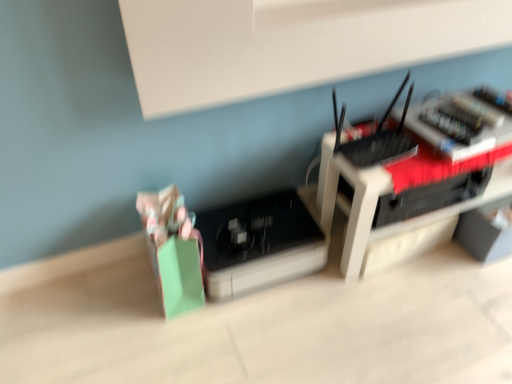
In order to click on black plastic router at upper right, positioned as the 2th register in back-to-front order in this screenshot , I will do `click(379, 139)`.

You are a GUI agent. You are given a task and a screenshot of the screen. Output one action in this format:
    pyautogui.click(x=<x>, y=<y>)
    Task: Click on the black plastic register at center, the 2th register from the top
    The image size is (512, 384).
    Given the screenshot: What is the action you would take?
    pos(259,244)

Based on their positions, is black plastic router at upper right, the 1th register when ordered from top to bottom, located to the left or right of black plastic register at center, the 2th register from the top?

Based on their positions, black plastic router at upper right, the 1th register when ordered from top to bottom, is located to the right of black plastic register at center, the 2th register from the top.

Can you see black plastic router at upper right, positioned as the first register in front-to-back order, touching black plastic register at center, marked as the first register in a back-to-front arrangement?

black plastic router at upper right, positioned as the first register in front-to-back order, is not next to black plastic register at center, marked as the first register in a back-to-front arrangement, and they're not touching.

From a real-world perspective, between black plastic router at upper right, positioned as the 2th register in back-to-front order, and black plastic register at center, marked as the first register in a back-to-front arrangement, who is vertically lower?

black plastic register at center, marked as the first register in a back-to-front arrangement, is physically lower.

Is black plastic register at center, the first register positioned from the left, facing away from black plastic router at upper right, positioned as the first register in front-to-back order?

No.

Does black plastic register at center, the first register positioned from the left, have a smaller size compared to black plastic router at upper right, which ranks as the 2th register in bottom-to-top order?

No, black plastic register at center, the first register positioned from the left, is not smaller than black plastic router at upper right, which ranks as the 2th register in bottom-to-top order.

Between black plastic register at center, marked as the first register in a back-to-front arrangement, and black plastic router at upper right, which ranks as the 2th register in bottom-to-top order, which one is positioned behind?

black plastic register at center, marked as the first register in a back-to-front arrangement, is further from the camera.

How many degrees apart are the facing directions of black plastic register at center, marked as the first register in a bottom-to-top arrangement, and black plastic router at upper right, positioned as the 2th register in back-to-front order?

black plastic register at center, marked as the first register in a bottom-to-top arrangement, and black plastic router at upper right, positioned as the 2th register in back-to-front order, are facing 6.16 degrees away from each other.

Is the depth of black plastic router at upper right, positioned as the first register in front-to-back order, greater than that of black plastic router at center?

No, black plastic router at upper right, positioned as the first register in front-to-back order, is closer to the camera.

Based on their sizes in the image, would you say black plastic router at upper right, which ranks as the 2th register in bottom-to-top order, is bigger or smaller than black plastic router at center?

black plastic router at upper right, which ranks as the 2th register in bottom-to-top order, is smaller than black plastic router at center.

Based on the photo, from the image's perspective, does black plastic router at upper right, which ranks as the 2th register in bottom-to-top order, appear higher than black plastic router at center?

Yes, from the image's perspective, black plastic router at upper right, which ranks as the 2th register in bottom-to-top order, is on top of black plastic router at center.

Is black plastic router at upper right, positioned as the 2th register in back-to-front order, to the left of black plastic router at center from the viewer's perspective?

Indeed, black plastic router at upper right, positioned as the 2th register in back-to-front order, is positioned on the left side of black plastic router at center.

Looking at this image, in terms of height, does black plastic router at center look taller or shorter compared to black plastic register at center, placed as the second register when sorted from right to left?

Clearly, black plastic router at center is taller compared to black plastic register at center, placed as the second register when sorted from right to left.

Measure the distance between black plastic router at center and black plastic register at center, the 2th register from the top.

black plastic router at center is 11.00 inches away from black plastic register at center, the 2th register from the top.

From the image's perspective, which one is positioned lower, black plastic router at center or black plastic register at center, which ranks as the second register in front-to-back order?

black plastic register at center, which ranks as the second register in front-to-back order, is shown below in the image.

I want to click on furniture lying in front of the black plastic register at center, which ranks as the second register in front-to-back order, so click(393, 194).

Is black plastic router at center turned away from black plastic router at upper right, the first register viewed from the right?

No.

Is black plastic router at center inside the boundaries of black plastic router at upper right, placed as the 2th register when sorted from left to right, or outside?

black plastic router at center is not enclosed by black plastic router at upper right, placed as the 2th register when sorted from left to right.

Which is further, (373, 261) or (413, 146)?

Point (373, 261)

Considering the sizes of objects black plastic router at center and black plastic router at upper right, the 1th register when ordered from top to bottom, in the image provided, who is smaller, black plastic router at center or black plastic router at upper right, the 1th register when ordered from top to bottom,?

black plastic router at upper right, the 1th register when ordered from top to bottom, is smaller.

From a real-world perspective, is black plastic register at center, the first register positioned from the left, physically located above or below black plastic router at center?

In terms of real-world spatial position, black plastic register at center, the first register positioned from the left, is below black plastic router at center.

Could you measure the distance between black plastic register at center, which ranks as the second register in front-to-back order, and black plastic router at center?

black plastic register at center, which ranks as the second register in front-to-back order, is 27.93 centimeters away from black plastic router at center.

Who is shorter, black plastic register at center, which ranks as the second register in front-to-back order, or black plastic router at center?

Standing shorter between the two is black plastic register at center, which ranks as the second register in front-to-back order.

From the image's perspective, is black plastic register at center, marked as the first register in a bottom-to-top arrangement, located above black plastic router at center?

Incorrect, from the image's perspective, black plastic register at center, marked as the first register in a bottom-to-top arrangement, is lower than black plastic router at center.

At what (x,y) coordinates should I click in order to perform the action: click on register behind the black plastic router at upper right, which ranks as the 2th register in bottom-to-top order. Please return your answer as a coordinate pair (x, y). This screenshot has width=512, height=384. Looking at the image, I should click on (259, 244).

Image resolution: width=512 pixels, height=384 pixels. In order to click on register located underneath the black plastic router at upper right, which ranks as the 2th register in bottom-to-top order (from a real-world perspective) in this screenshot , I will do `click(259, 244)`.

Based on their spatial positions, is black plastic router at upper right, positioned as the first register in front-to-back order, or black plastic register at center, the 2th register from the top, further from black plastic router at center?

black plastic register at center, the 2th register from the top.

Estimate the real-world distances between objects in this image. Which object is further from black plastic router at upper right, which ranks as the 2th register in bottom-to-top order, black plastic register at center, which ranks as the second register in front-to-back order, or black plastic router at center?

Among the two, black plastic register at center, which ranks as the second register in front-to-back order, is located further to black plastic router at upper right, which ranks as the 2th register in bottom-to-top order.

Which object lies further to the anchor point black plastic register at center, marked as the first register in a back-to-front arrangement, black plastic router at center or black plastic router at upper right, the 1th register when ordered from top to bottom?

Based on the image, black plastic router at upper right, the 1th register when ordered from top to bottom, appears to be further to black plastic register at center, marked as the first register in a back-to-front arrangement.

In the scene shown: Based on their spatial positions, is black plastic router at upper right, the 1th register when ordered from top to bottom, or black plastic router at center further from black plastic register at center, which ranks as the second register in front-to-back order?

black plastic router at upper right, the 1th register when ordered from top to bottom, is further to black plastic register at center, which ranks as the second register in front-to-back order.

Looking at the image, which one is located further to black plastic router at upper right, positioned as the 2th register in back-to-front order, black plastic router at center or black plastic register at center, the 2th register from the top?

black plastic register at center, the 2th register from the top, is positioned further to the anchor black plastic router at upper right, positioned as the 2th register in back-to-front order.

From the image, which object appears to be farther from black plastic router at center, black plastic register at center, the 2th register from the top, or black plastic router at upper right, the first register viewed from the right?

Based on the image, black plastic register at center, the 2th register from the top, appears to be further to black plastic router at center.

I want to click on register situated between black plastic register at center, placed as the second register when sorted from right to left, and black plastic router at center from left to right, so click(x=379, y=139).